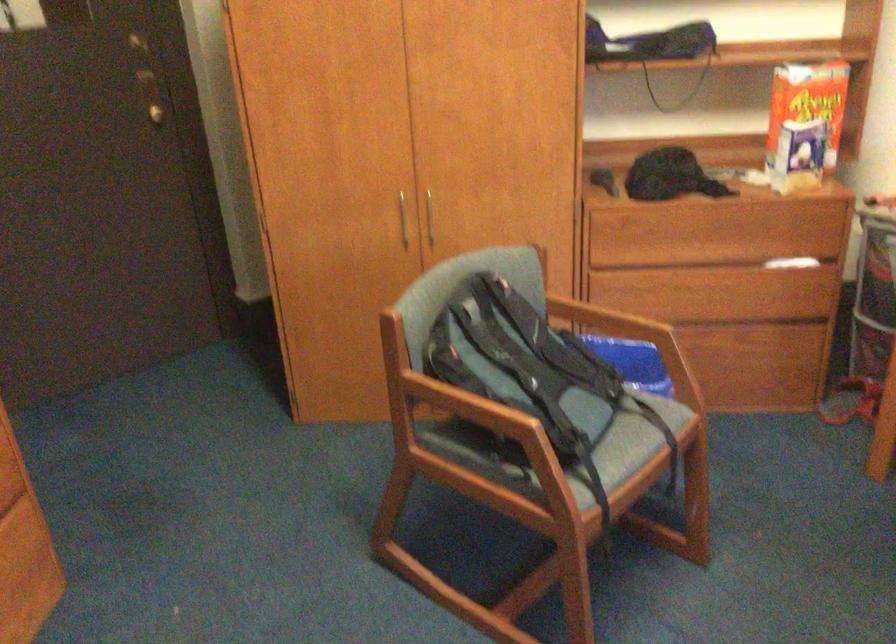
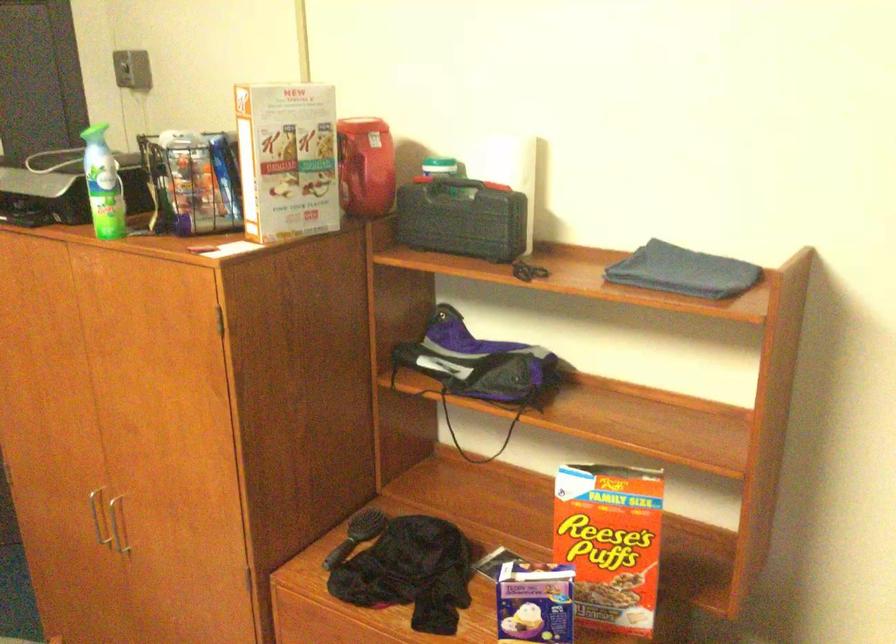
The images are taken continuously from a first-person perspective. In which direction are you moving?

The cameraman moved toward right, forward.